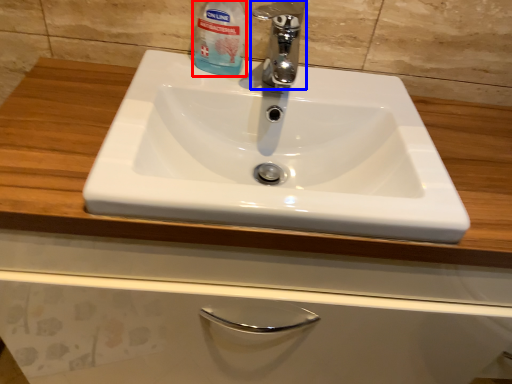
Question: Which object is further to the camera taking this photo, cleaning product (highlighted by a red box) or tap (highlighted by a blue box)?

Choices:
 (A) cleaning product
 (B) tap

Answer: (A)